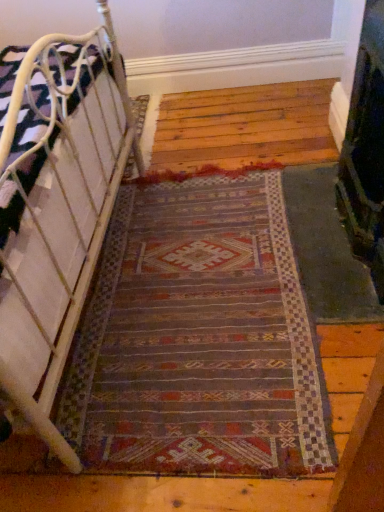
At what (x,y) coordinates should I click in order to perform the action: click on blank space to the left of dark green textured fireplace at right. Please return your answer as a coordinate pair (x, y). Image resolution: width=384 pixels, height=512 pixels. Looking at the image, I should click on (226, 257).